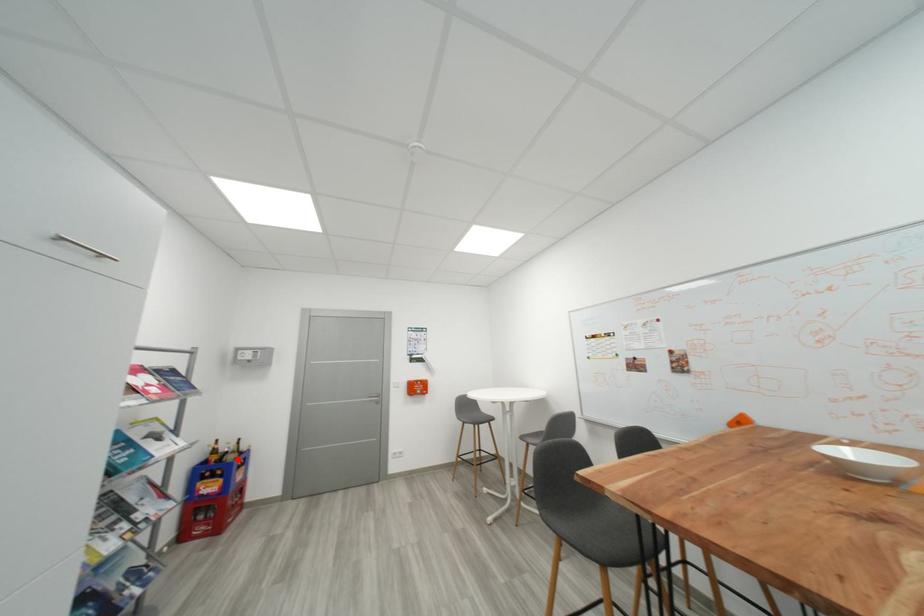
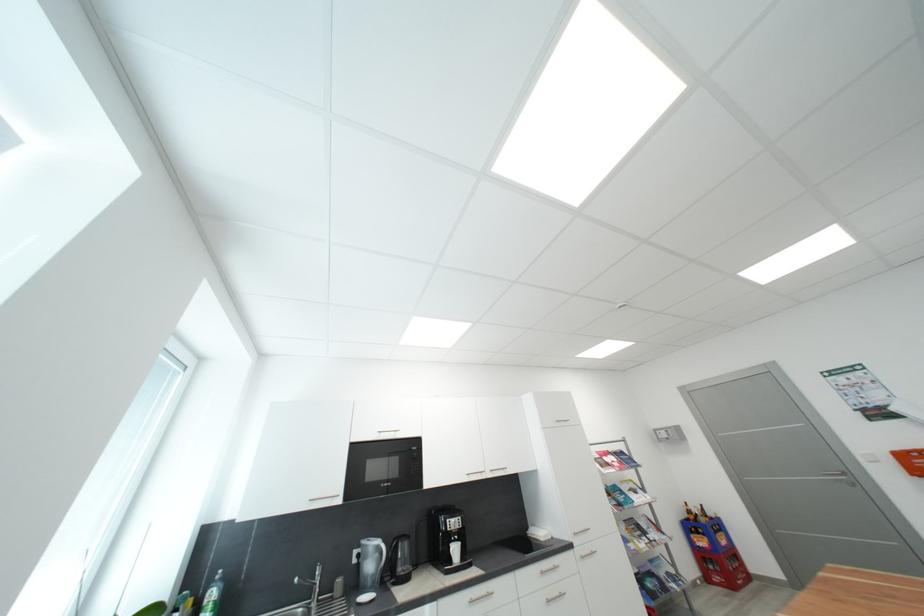
Question: A red point is marked in image1. In image2, is the corresponding 3D point closer to the camera or farther? Reply with the corresponding letter.

Choices:
 (A) The corresponding 3D point is closer.
 (B) The corresponding 3D point is farther.

Answer: (A)